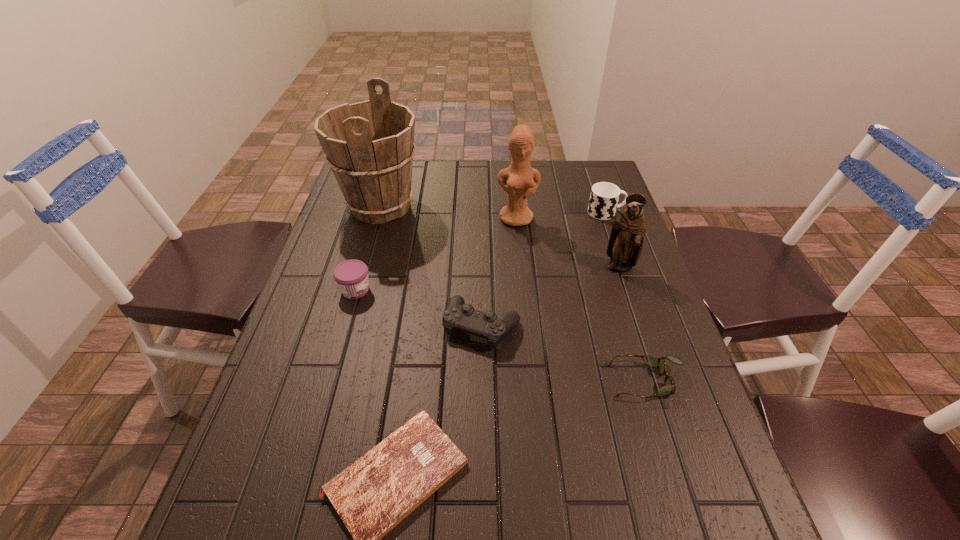
Identify the location of free point that satisfies the following two spatial constraints: 1. on the front label of the control; 2. on the left side of the jam. tap(346, 326).

This screenshot has width=960, height=540. Identify the location of free location that satisfies the following two spatial constraints: 1. on the side of the cup with the handle; 2. on the front side of the third nearest object. (645, 326).

Where is `free space that satisfies the following two spatial constraints: 1. on the side of the cup with the handle; 2. on the front-facing side of the taller figurine`? free space that satisfies the following two spatial constraints: 1. on the side of the cup with the handle; 2. on the front-facing side of the taller figurine is located at coordinates (608, 218).